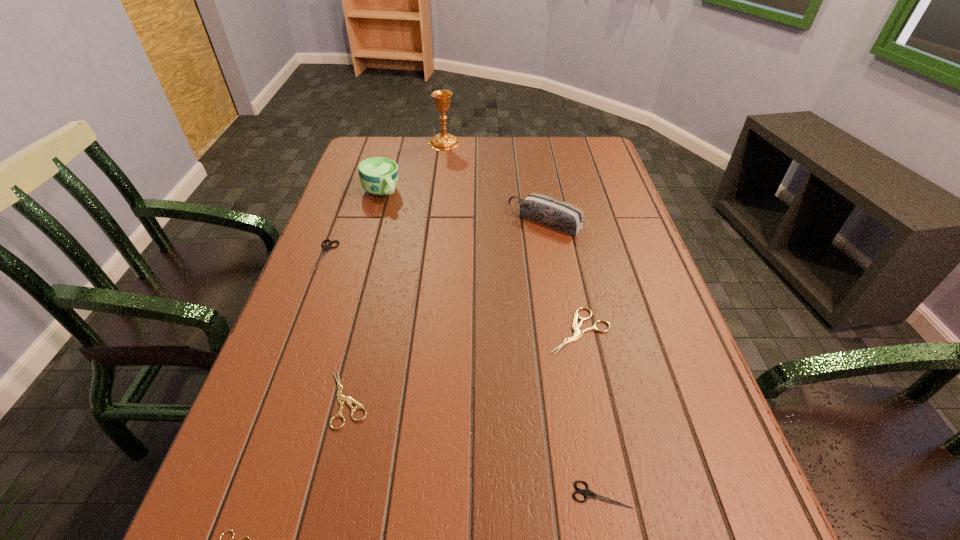
Identify the location of the closest shears to the fifth farthest object. (587, 493).

Locate which shears is the fourth closest to the gold chalice. Please provide its 2D coordinates. Your answer should be formatted as a tuple, i.e. [(x, y)], where the tuple contains the x and y coordinates of a point satisfying the conditions above.

[(587, 493)]

Locate which beige shears ranks second in proximity to the bigger black shears. Please provide its 2D coordinates. Your answer should be formatted as a tuple, i.e. [(x, y)], where the tuple contains the x and y coordinates of a point satisfying the conditions above.

[(578, 333)]

You are a GUI agent. You are given a task and a screenshot of the screen. Output one action in this format:
    pyautogui.click(x=<x>, y=<y>)
    Task: Click on the second closest beige shears to the pencil box
    This screenshot has height=540, width=960.
    Given the screenshot: What is the action you would take?
    pyautogui.click(x=342, y=399)

Where is `vacant area in the image that satisfies the following two spatial constraints: 1. on the back side of the cup; 2. on the right side of the farthest object`? vacant area in the image that satisfies the following two spatial constraints: 1. on the back side of the cup; 2. on the right side of the farthest object is located at coordinates (396, 143).

This screenshot has height=540, width=960. What are the coordinates of `free space that satisfies the following two spatial constraints: 1. on the front side of the rightmost beige shears; 2. on the right side of the third tallest object` in the screenshot? It's located at (564, 331).